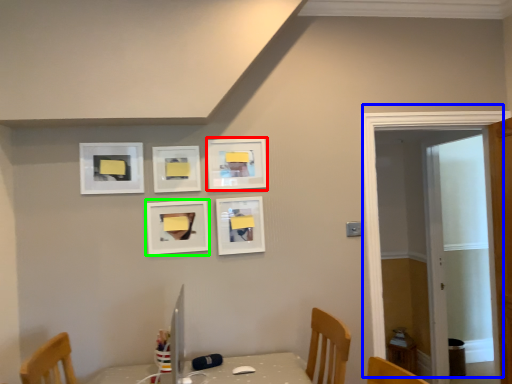
Question: Estimate the real-world distances between objects in this image. Which object is closer to picture frame (highlighted by a red box), door (highlighted by a blue box) or picture frame (highlighted by a green box)?

Choices:
 (A) door
 (B) picture frame

Answer: (B)